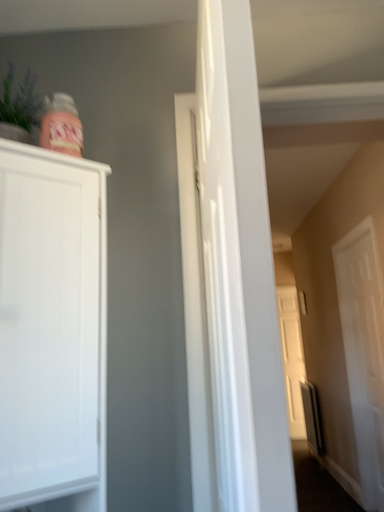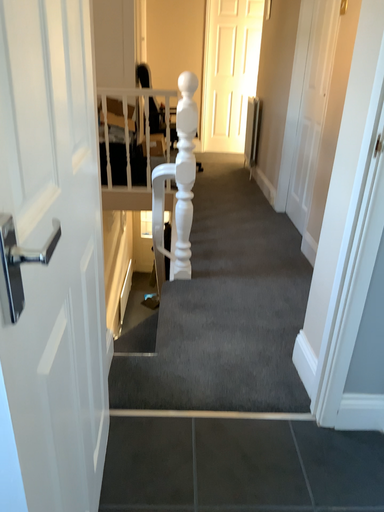
Question: Which way did the camera rotate in the video?

Choices:
 (A) rotated downward
 (B) rotated upward

Answer: (A)